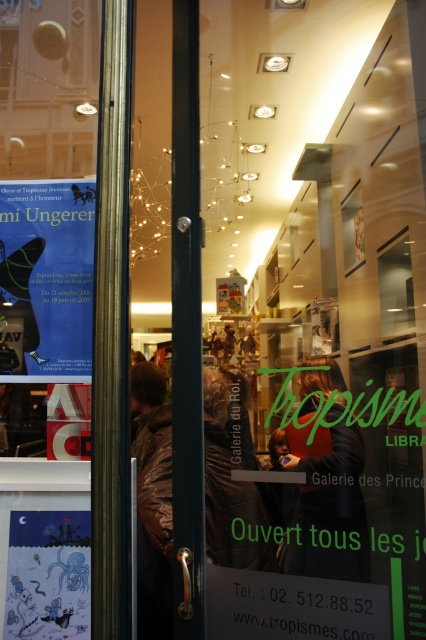
You are standing at the entrance of the bookstore and want to read the matte paper poster at upper left. Can you read it without moving closer?

Result: The matte paper poster at upper left is 5.30 feet away from the viewer, so you can read it without moving closer if you have good eyesight, as the distance is within a typical comfortable reading range.

You are standing at the entrance of Tropismes Librairie and want to go to the point labeled point (49, 544). Which direction should you move relative to point (317, 509)?

Since point (317, 509) is in front of point (49, 544), you should move backward from point (317, 509) to reach point (49, 544).